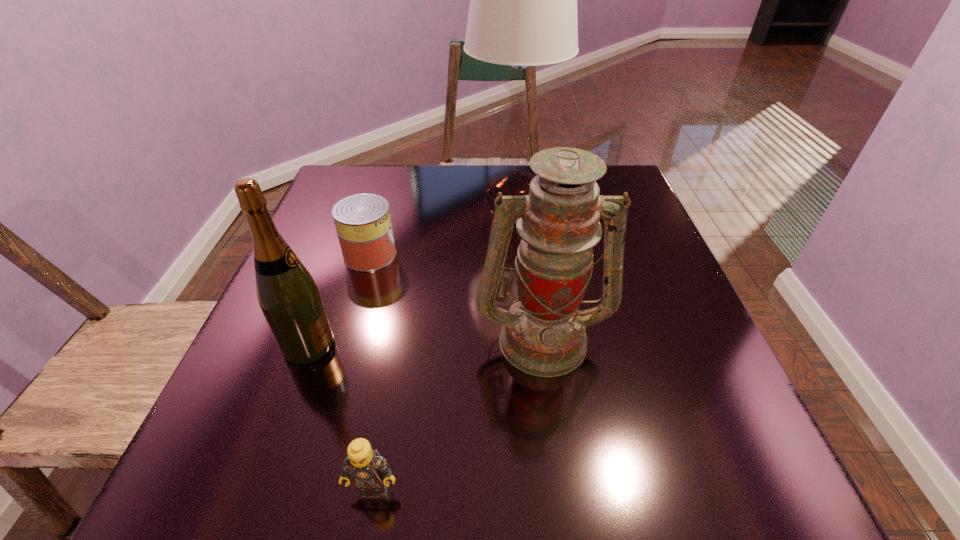
In the image, there is a desktop. Identify the location of vacant space at the far right corner. (610, 170).

Find the location of a particular element. The height and width of the screenshot is (540, 960). vacant space that's between the oil lamp and the can is located at coordinates (456, 296).

Locate an element on the screen. The height and width of the screenshot is (540, 960). free space between the Lego and the wine bottle is located at coordinates (341, 417).

Locate an element on the screen. The image size is (960, 540). unoccupied area between the oil lamp and the can is located at coordinates pyautogui.click(x=456, y=296).

I want to click on empty space between the third object from left to right and the can, so (372, 372).

What are the coordinates of `unoccupied area between the tallest object and the can` in the screenshot? It's located at (442, 224).

The height and width of the screenshot is (540, 960). In order to click on vacant space in between the oil lamp and the wine bottle in this screenshot , I will do [x=425, y=342].

Where is `empty space that is in between the farthest object and the second farthest object`? The image size is (960, 540). empty space that is in between the farthest object and the second farthest object is located at coordinates (442, 224).

Identify the location of free spot between the oil lamp and the second farthest object. Image resolution: width=960 pixels, height=540 pixels. (456, 296).

You are a GUI agent. You are given a task and a screenshot of the screen. Output one action in this format:
    pyautogui.click(x=<x>, y=<y>)
    Task: Click on the free area in between the nearest object and the can
    
    Given the screenshot: What is the action you would take?
    pyautogui.click(x=372, y=372)